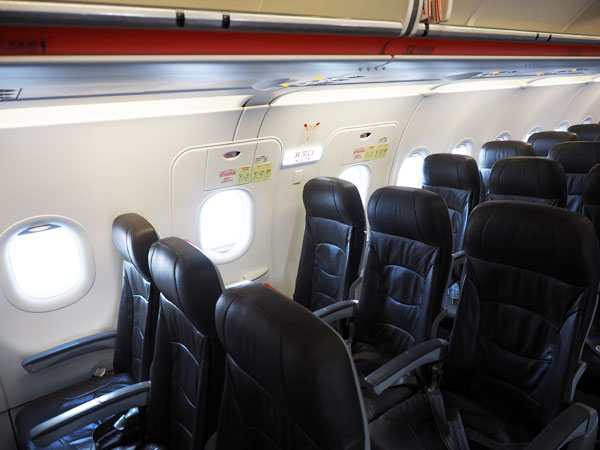
Locate an element on the screen. The image size is (600, 450). arm rests is located at coordinates (459, 257), (340, 308), (397, 369), (572, 429), (70, 413), (70, 351).